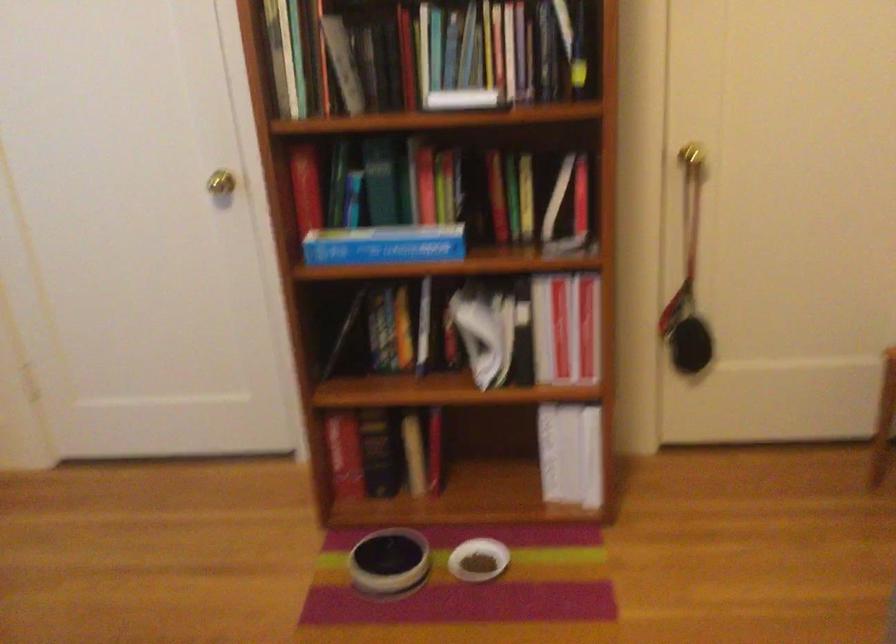
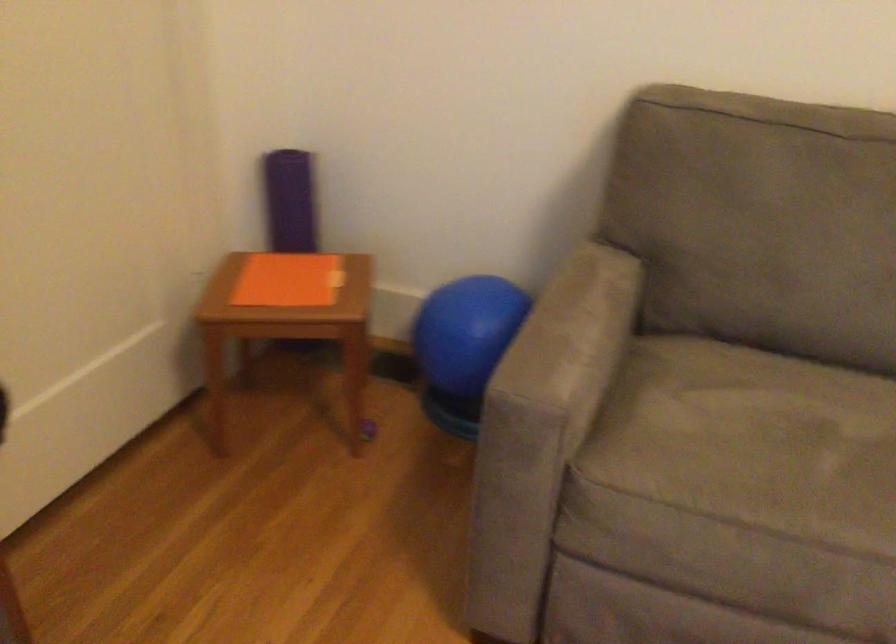
Question: The camera is either moving clockwise (left) or counter-clockwise (right) around the object. The first image is from the beginning of the video and the second image is from the end. Is the camera moving left or right when shooting the video?

Choices:
 (A) Left
 (B) Right

Answer: (A)